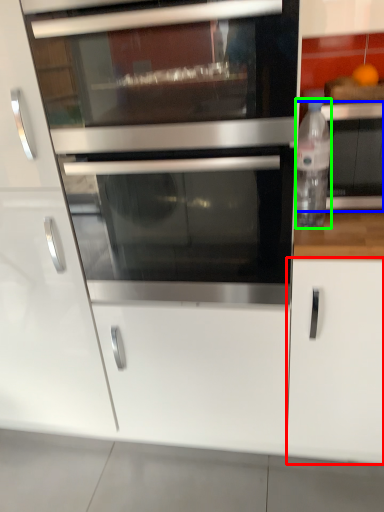
Question: Estimate the real-world distances between objects in this image. Which object is closer to cabinetry (highlighted by a red box), appliance (highlighted by a blue box) or bottle (highlighted by a green box)?

Choices:
 (A) appliance
 (B) bottle

Answer: (B)